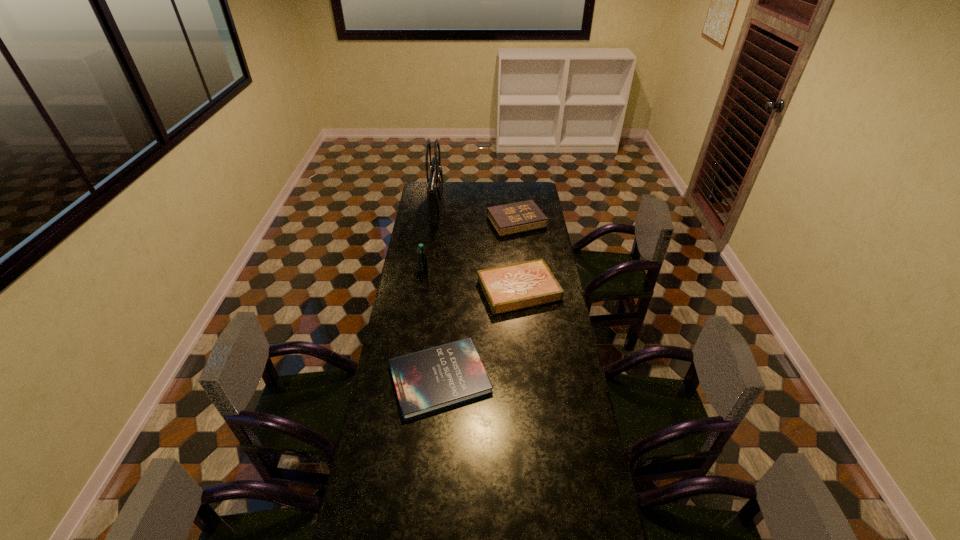
This screenshot has width=960, height=540. Identify the location of free point located on the back of the third shortest object. (513, 191).

Locate an element on the screen. The height and width of the screenshot is (540, 960). vacant region located 0.370m on the left of the second shortest object is located at coordinates (399, 289).

The image size is (960, 540). Identify the location of vacant space located 0.290m on the front of the nearest hardback book. (429, 505).

Where is `object located at the far edge`? object located at the far edge is located at coordinates (435, 180).

Image resolution: width=960 pixels, height=540 pixels. In order to click on handbag at the left edge in this screenshot , I will do `click(435, 180)`.

Where is `water bottle positioned at the left edge`? This screenshot has height=540, width=960. water bottle positioned at the left edge is located at coordinates (422, 259).

Find the location of a particular element. The width and height of the screenshot is (960, 540). hardback book that is at the left edge is located at coordinates (426, 381).

At what (x,y) coordinates should I click in order to perform the action: click on object that is at the far left corner. Please return your answer as a coordinate pair (x, y). Image resolution: width=960 pixels, height=540 pixels. Looking at the image, I should click on [x=435, y=180].

The height and width of the screenshot is (540, 960). Find the location of `free space at the left edge of the desktop`. free space at the left edge of the desktop is located at coordinates (396, 395).

What are the coordinates of `blank area at the right edge` in the screenshot? It's located at (588, 475).